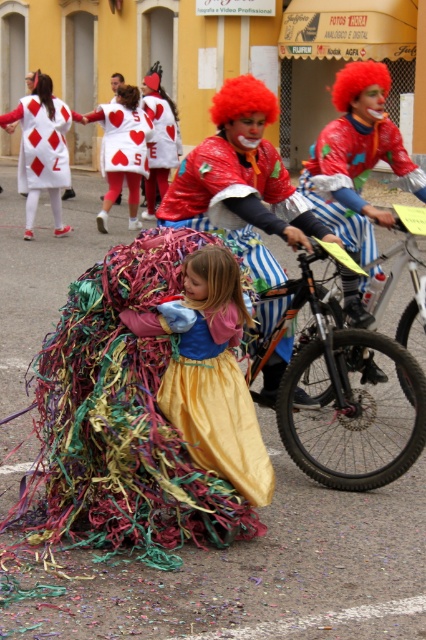
Question: From the image, what is the correct spatial relationship of matte white dress at upper left in relation to golden silky wig at center?

Choices:
 (A) left
 (B) right

Answer: (A)

Question: Which of the following is the farthest from the observer?

Choices:
 (A) shiny metallic helmet at center
 (B) gold satin dress at center

Answer: (A)

Question: Considering the real-world distances, which object is farthest from the matte red heart at center?

Choices:
 (A) matte white dress at upper left
 (B) red heart-patterned costume at center
 (C) golden silky wig at center

Answer: (C)

Question: Which point is farther to the camera?

Choices:
 (A) (173, 404)
 (B) (108, 113)
 (C) (155, 179)

Answer: (C)

Question: Is red heart-patterned costume at center further to the viewer compared to golden silky wig at center?

Choices:
 (A) yes
 (B) no

Answer: (A)

Question: Considering the relative positions of shiny tinsel dress at center and red synthetic wig at upper left in the image provided, where is shiny tinsel dress at center located with respect to red synthetic wig at upper left?

Choices:
 (A) right
 (B) left

Answer: (A)